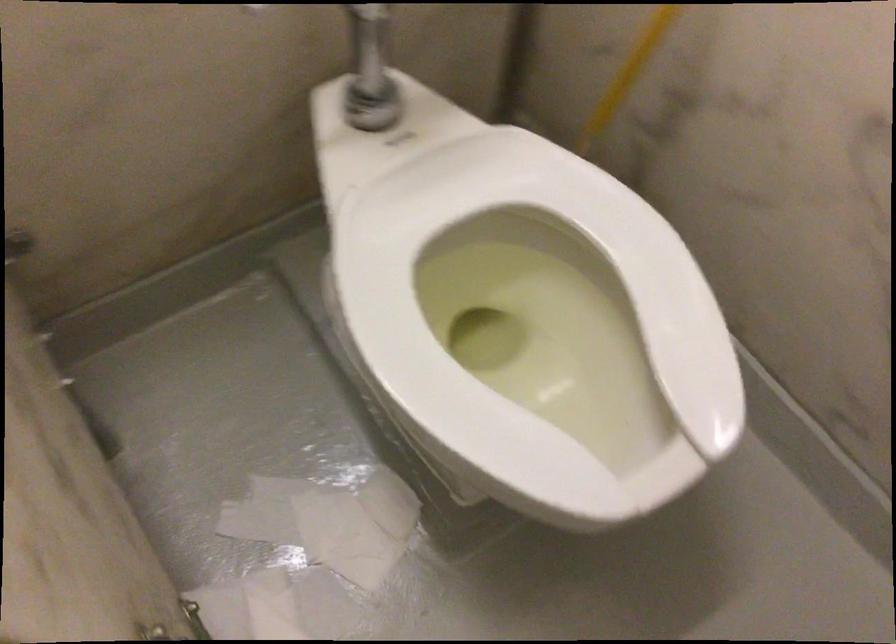
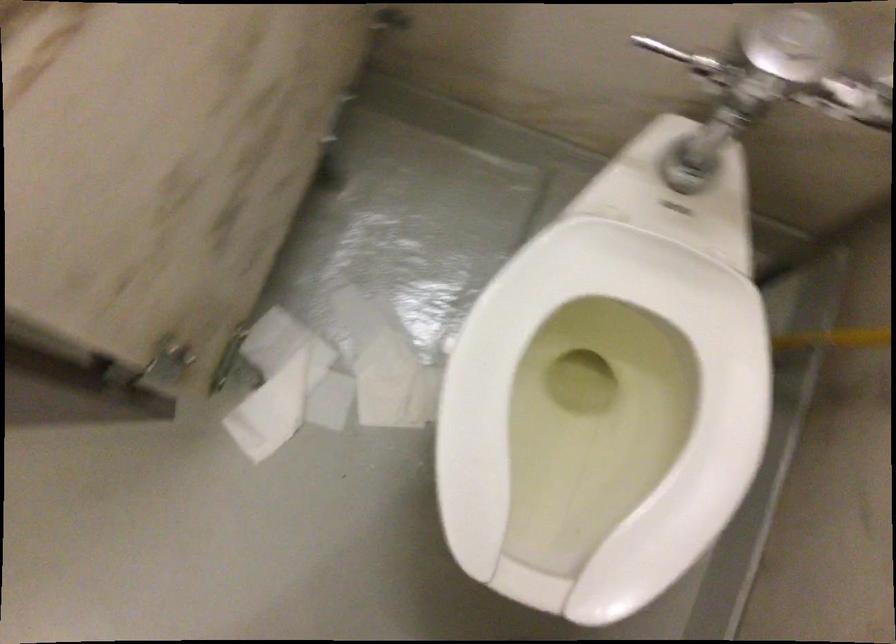
Question: The first image is from the beginning of the video and the second image is from the end. How did the camera likely rotate when shooting the video?

Choices:
 (A) Left
 (B) Right
 (C) Up
 (D) Down

Answer: (D)